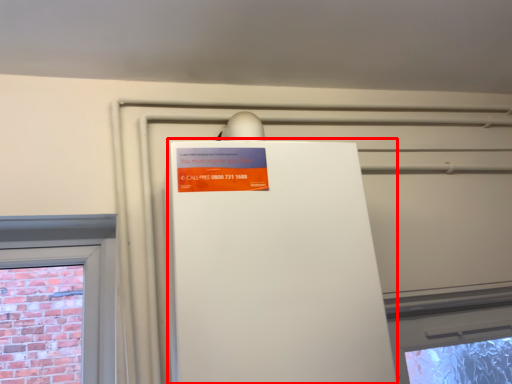
Question: From the image's perspective, considering the relative positions of appliance (annotated by the red box) and advertisement in the image provided, where is appliance (annotated by the red box) located with respect to the staircase?

Choices:
 (A) above
 (B) below

Answer: (B)